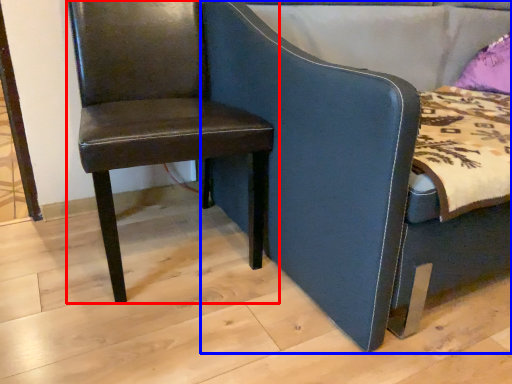
Question: Which object is closer to the camera taking this photo, chair (highlighted by a red box) or chair (highlighted by a blue box)?

Choices:
 (A) chair
 (B) chair

Answer: (B)